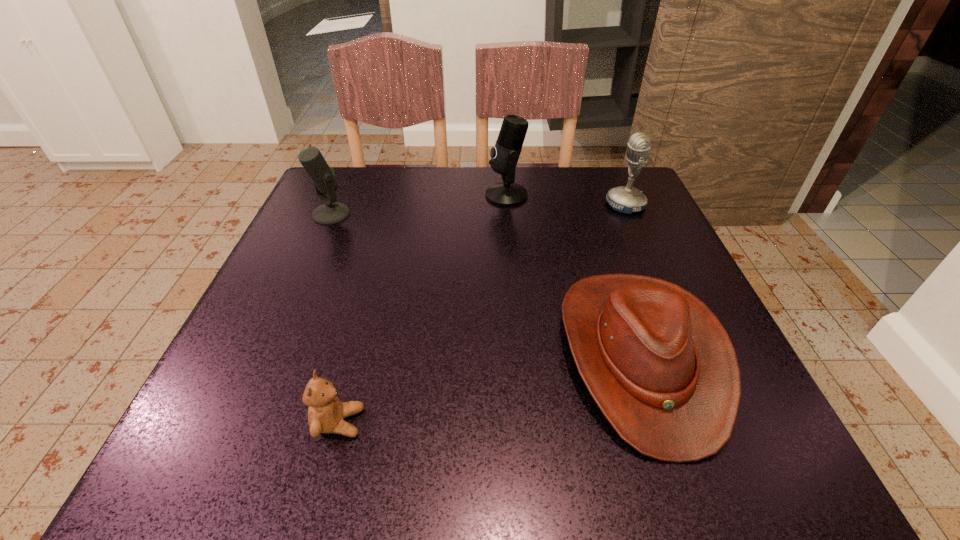
Identify which microphone is located as the second nearest to the rightmost microphone. Please provide its 2D coordinates. Your answer should be formatted as a tuple, i.e. [(x, y)], where the tuple contains the x and y coordinates of a point satisfying the conditions above.

[(325, 181)]

Where is `the closest microphone relative to the leftmost object`? The width and height of the screenshot is (960, 540). the closest microphone relative to the leftmost object is located at coordinates (504, 156).

Identify the location of free space that satisfies the following two spatial constraints: 1. on the front-facing side of the cowboy hat; 2. on the face of the fourth object from right to left. The height and width of the screenshot is (540, 960). (664, 422).

Image resolution: width=960 pixels, height=540 pixels. I want to click on free location that satisfies the following two spatial constraints: 1. on the front-facing side of the cowboy hat; 2. on the face of the fourth object from right to left, so click(x=664, y=422).

The image size is (960, 540). What are the coordinates of `free space that satisfies the following two spatial constraints: 1. on the front-facing side of the rightmost microphone; 2. on the front-facing side of the cowboy hat` in the screenshot? It's located at (692, 355).